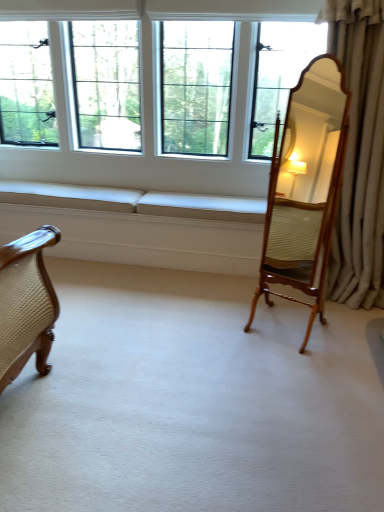
Question: Is clear glass windows at center located within wooden mirror at right?

Choices:
 (A) no
 (B) yes

Answer: (A)

Question: Can you confirm if wooden mirror at right is shorter than clear glass windows at center?

Choices:
 (A) no
 (B) yes

Answer: (A)

Question: Is wooden mirror at right smaller than clear glass windows at center?

Choices:
 (A) yes
 (B) no

Answer: (A)

Question: Does wooden mirror at right come behind clear glass windows at center?

Choices:
 (A) yes
 (B) no

Answer: (B)

Question: Can you confirm if wooden mirror at right is thinner than clear glass windows at center?

Choices:
 (A) no
 (B) yes

Answer: (B)

Question: Is point (342, 257) positioned closer to the camera than point (129, 206)?

Choices:
 (A) farther
 (B) closer

Answer: (B)

Question: From a real-world perspective, is silky beige curtain at right physically located above or below beige fabric couch at lower left?

Choices:
 (A) below
 (B) above

Answer: (B)

Question: From the image's perspective, is silky beige curtain at right above or below beige fabric couch at lower left?

Choices:
 (A) above
 (B) below

Answer: (A)

Question: Looking at the image, does silky beige curtain at right seem bigger or smaller compared to beige fabric couch at lower left?

Choices:
 (A) small
 (B) big

Answer: (B)

Question: From a real-world perspective, relative to beige fabric couch at lower left, is clear glass windows at center vertically above or below?

Choices:
 (A) above
 (B) below

Answer: (A)

Question: Is clear glass windows at center in front of or behind beige fabric couch at lower left in the image?

Choices:
 (A) behind
 (B) front

Answer: (B)

Question: Would you say clear glass windows at center is inside or outside beige fabric couch at lower left?

Choices:
 (A) inside
 (B) outside

Answer: (B)

Question: Visually, is clear glass windows at center positioned to the left or to the right of beige fabric couch at lower left?

Choices:
 (A) right
 (B) left

Answer: (A)

Question: Is silky beige curtain at right to the left or to the right of wooden mirror at right in the image?

Choices:
 (A) left
 (B) right

Answer: (B)

Question: In the image, is silky beige curtain at right positioned in front of or behind wooden mirror at right?

Choices:
 (A) front
 (B) behind

Answer: (B)